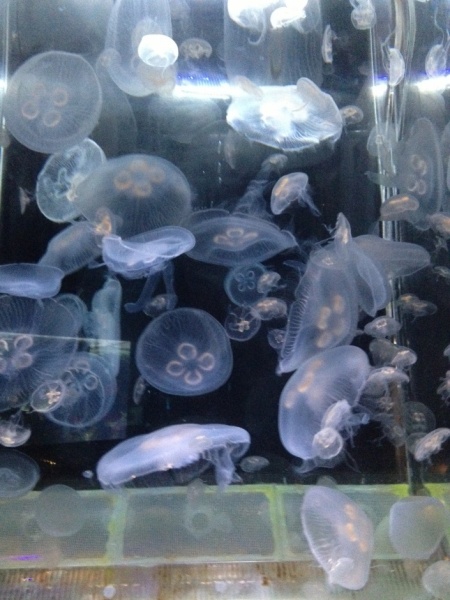
Image resolution: width=450 pixels, height=600 pixels. Find the location of `led bar light`. led bar light is located at coordinates (428, 85), (205, 91).